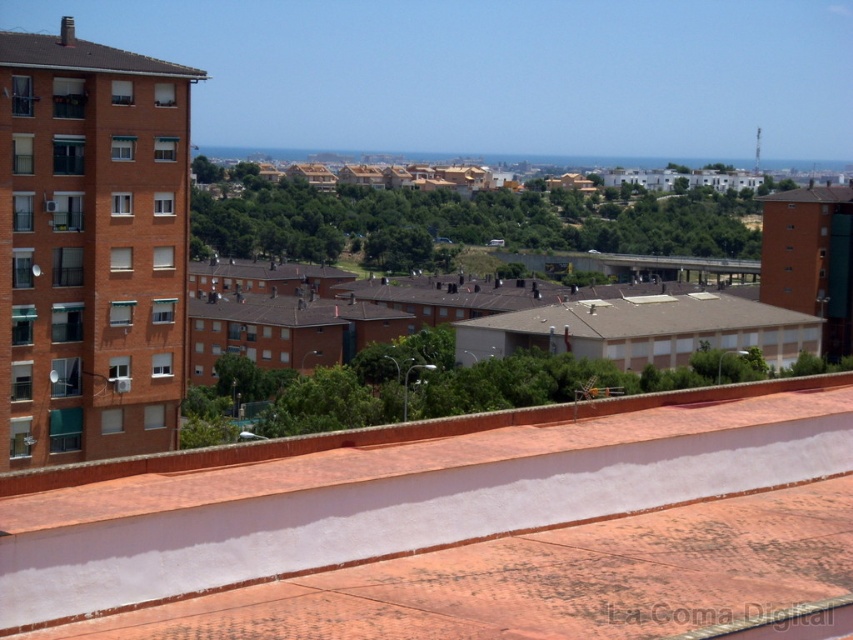
Question: Is brown/flat roof at center smaller than brown tiled roof at upper left?

Choices:
 (A) no
 (B) yes

Answer: (A)

Question: Which of the following is the farthest from the observer?

Choices:
 (A) (56, 42)
 (B) (786, 316)
 (C) (779, 198)
 (D) (22, 593)

Answer: (C)

Question: Estimate the real-world distances between objects in this image. Which object is closer to the white smooth roof at center?

Choices:
 (A) brown tile roof at upper right
 (B) brown tiled roof at upper left

Answer: (B)

Question: Which object is closer to the camera taking this photo?

Choices:
 (A) brown/flat roof at center
 (B) brown tiled roof at upper left
 (C) white smooth roof at center

Answer: (C)

Question: Does brown/flat roof at center appear under brown tiled roof at upper left?

Choices:
 (A) no
 (B) yes

Answer: (B)

Question: Is brown/flat roof at center below brown tiled roof at upper left?

Choices:
 (A) no
 (B) yes

Answer: (B)